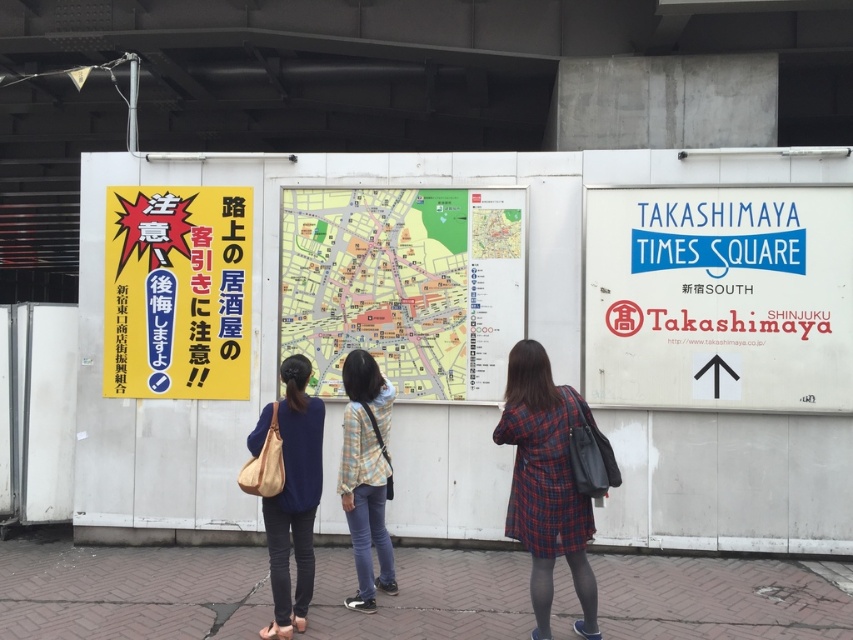
You are a delivery person with a 30 inch wide package. You need to move from the brick pavement at lower center to the light blue denim jeans at center. Can you pass through the space between them?

The brick pavement at lower center and light blue denim jeans at center are 32.00 inches apart. Since the package is 30 inches wide, it can pass through the space between them.

You are a construction worker standing in front of the wall. You need to determine if the yellow paper map at center is taller than the light blue denim jeans at center. Based on the scene description, what can you conclude?

The yellow paper map at center is not as tall as light blue denim jeans at center, so the map is shorter than the jeans.